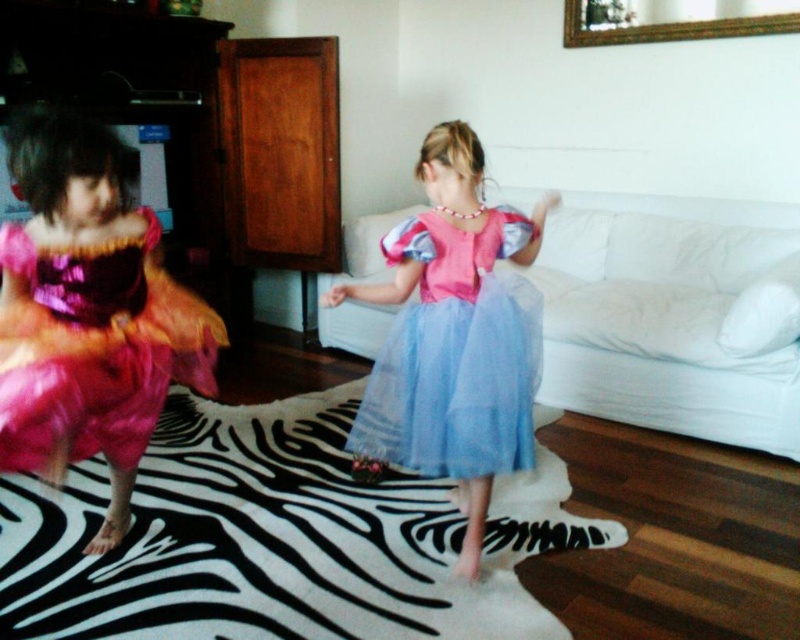
Question: Is shiny blue tulle dress at center below pink tulle dress at center?

Choices:
 (A) no
 (B) yes

Answer: (A)

Question: Which of the following is the closest to the observer?

Choices:
 (A) shiny blue tulle dress at center
 (B) pink tulle dress at center

Answer: (B)

Question: Which point is farther to the camera?

Choices:
 (A) shiny blue tulle dress at center
 (B) pink tulle dress at center

Answer: (A)

Question: Does shiny pink dress at left appear over pink tulle dress at center?

Choices:
 (A) yes
 (B) no

Answer: (A)

Question: In this image, where is shiny blue tulle dress at center located relative to pink tulle dress at center?

Choices:
 (A) below
 (B) above

Answer: (B)

Question: Which object is farther from the camera taking this photo?

Choices:
 (A) shiny pink dress at left
 (B) shiny blue tulle dress at center
 (C) pink tulle dress at center

Answer: (B)